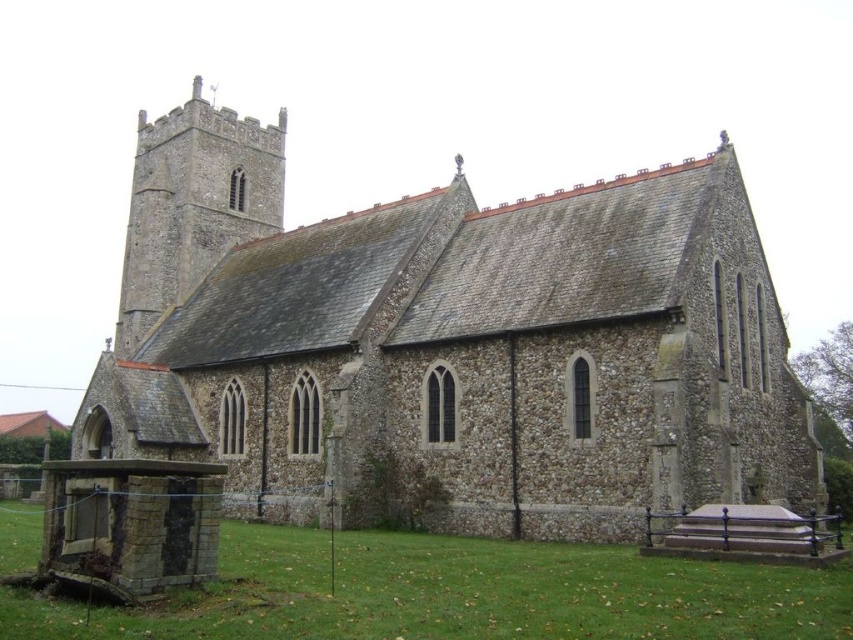
You are standing at the point marked as point (456,595) in the image. What do you see immediately to your left?

You see green grass at lower left immediately to your left at point (456,595).

You are standing in front of the historic stone church and want to place a small garden decoration. You see the green grass at lower left and the gray stone tower at upper left. Which object is located below the other?

The green grass at lower left is positioned under the gray stone tower at upper left.